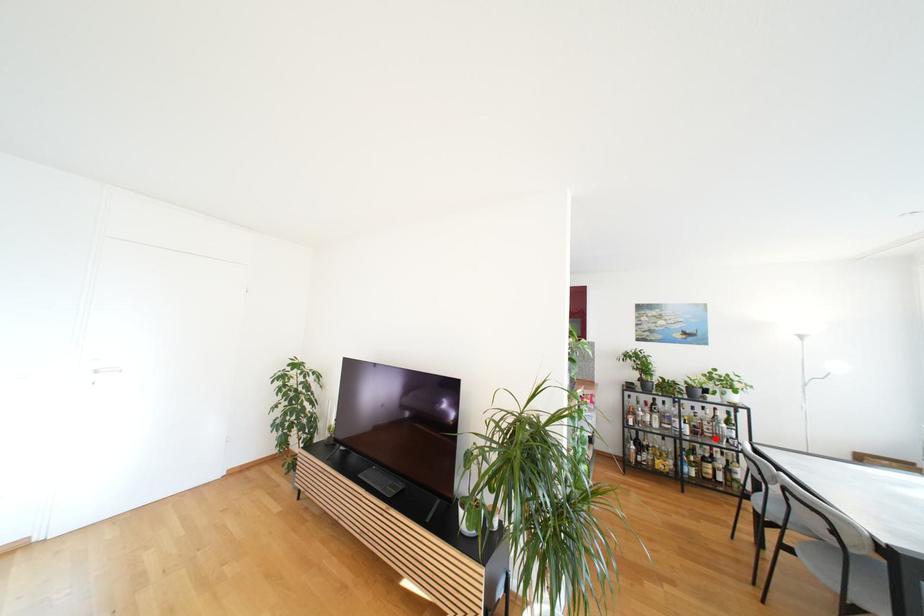
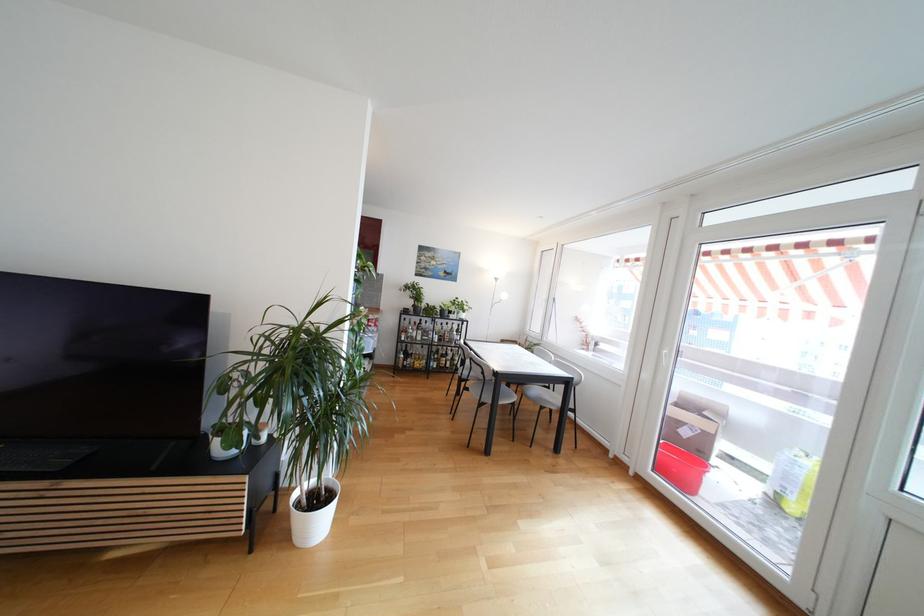
Find the pixel in the second image that matches the highlighted location in the first image.

(453, 342)